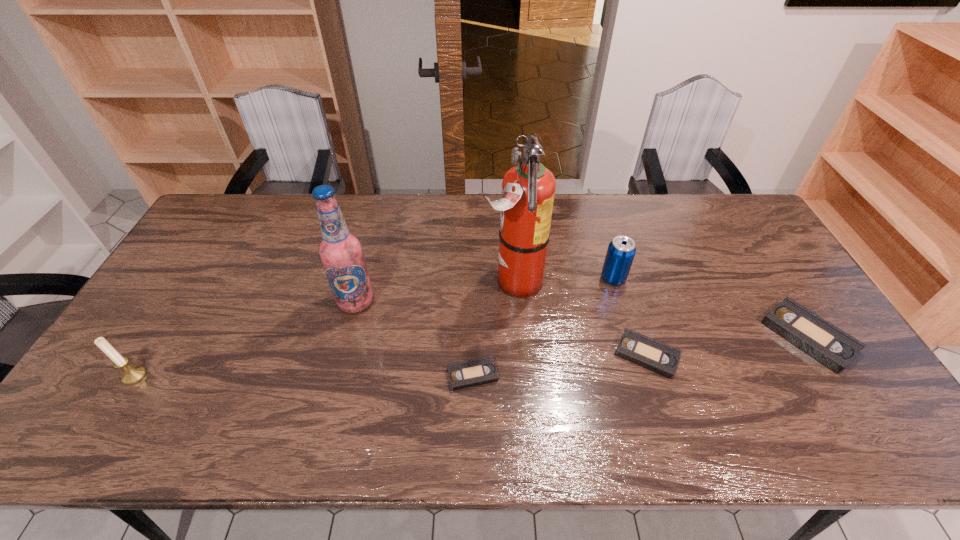
Locate an element on the screen. The width and height of the screenshot is (960, 540). candle holder that is at the near edge is located at coordinates (x=132, y=374).

This screenshot has height=540, width=960. What are the coordinates of `object at the left edge` in the screenshot? It's located at (132, 374).

This screenshot has width=960, height=540. In order to click on object at the right edge in this screenshot , I will do coord(828,344).

Identify the location of object situated at the near left corner. (132, 374).

Locate an element on the screen. The image size is (960, 540). vacant space at the far edge is located at coordinates [677, 218].

This screenshot has height=540, width=960. In the image, there is a desktop. What are the coordinates of `free space at the near edge` in the screenshot? It's located at (367, 406).

This screenshot has height=540, width=960. In the image, there is a desktop. Identify the location of vacant space at the far left corner. 234,198.

Identify the location of empty space that is in between the second videotape from left to right and the leftmost videotape. This screenshot has height=540, width=960. (560, 364).

The width and height of the screenshot is (960, 540). I want to click on free space between the second tallest object and the sixth tallest object, so click(x=501, y=328).

Where is `free point between the candle holder and the shortest videotape`? This screenshot has width=960, height=540. free point between the candle holder and the shortest videotape is located at coordinates (303, 375).